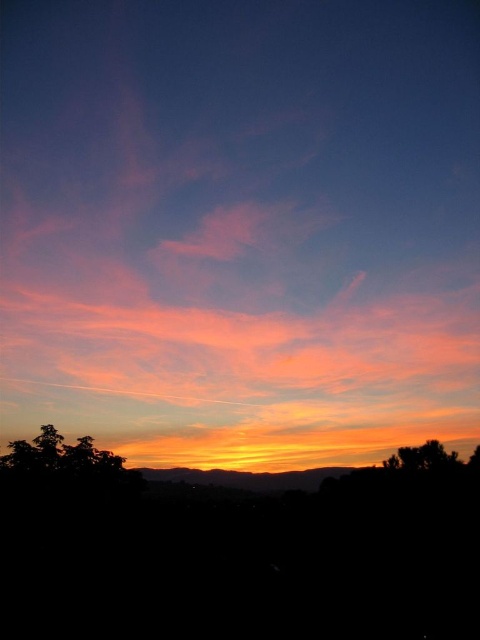
You are a photographer trying to capture the sunset. You notice the pink translucent cloud at upper center and the silhouette tree at lower left. Which object in the scene is larger in size?

The pink translucent cloud at upper center is bigger than the silhouette tree at lower left.

You are a photographer standing at the center of the scene. You want to take a photo that includes both the silhouette tree at lower left and the green leafy tree at lower right. Given that your camera has a maximum zoom range of 50 meters, can you capture both trees in a single frame without moving?

The distance between the silhouette tree at lower left and the green leafy tree at lower right is 64.33 meters. Since your camera can only zoom up to 50 meters, you cannot capture both trees in a single frame without moving closer or adjusting your position.